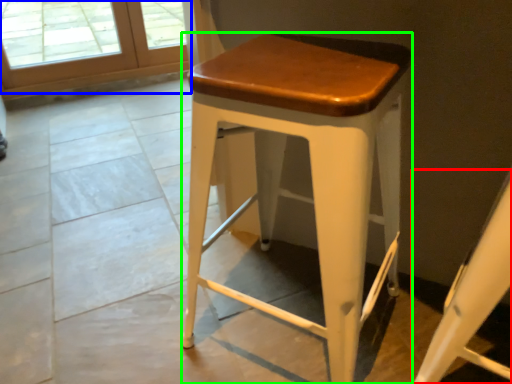
Question: Which object is positioned closest to swivel chair (highlighted by a red box)? Select from screen door (highlighted by a blue box) and stool (highlighted by a green box).

Choices:
 (A) screen door
 (B) stool

Answer: (B)